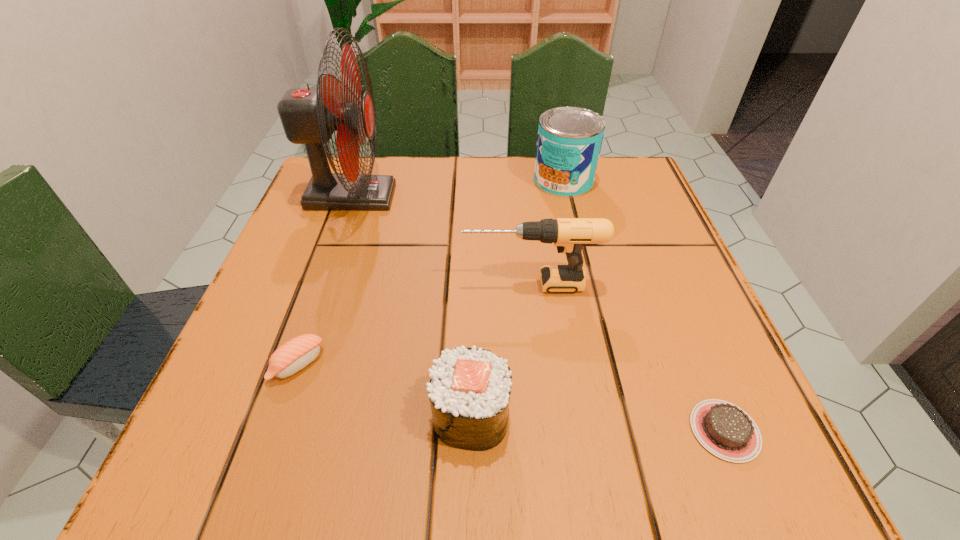
Locate an element on the screen. Image resolution: width=960 pixels, height=540 pixels. vacant area in the image that satisfies the following two spatial constraints: 1. on the handle side of the rightmost object; 2. on the right side of the drill is located at coordinates (548, 430).

Where is `free region that satisfies the following two spatial constraints: 1. on the handle side of the rightmost object; 2. on the right side of the fourth nearest object`? free region that satisfies the following two spatial constraints: 1. on the handle side of the rightmost object; 2. on the right side of the fourth nearest object is located at coordinates (548, 430).

The width and height of the screenshot is (960, 540). In order to click on free space that satisfies the following two spatial constraints: 1. on the handle side of the shortest object; 2. on the right side of the third farthest object in this screenshot , I will do `click(548, 430)`.